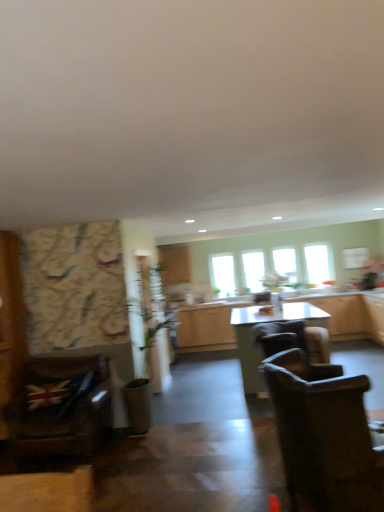
Measure the distance between velvet brown armchair at left, which appears as the 3th chair when viewed from the right, and camera.

A distance of 12.75 feet exists between velvet brown armchair at left, which appears as the 3th chair when viewed from the right, and camera.

How much space does matte wood cabinetry at center, the first cabinetry when ordered from top to bottom, occupy vertically?

It is 34.18 inches.

The height and width of the screenshot is (512, 384). What are the coordinates of `matte wood cabinetry at center, the 1th cabinetry viewed from the left` in the screenshot? It's located at (174, 264).

What is the approximate height of green leafy plant at center?

1.88 meters.

Measure the distance between point [313,245] and camera.

Point [313,245] is 23.21 feet from camera.

What do you see at coordinates (253, 270) in the screenshot?
I see `transparent glass window at center, which appears as the second window when viewed from the left` at bounding box center [253, 270].

What is the approximate width of dark brown fabric chair at lower right, acting as the third chair starting from the back?

dark brown fabric chair at lower right, acting as the third chair starting from the back, is 38.68 inches in width.

I want to click on velvet brown armchair at left, arranged as the second chair when viewed from the back, so click(60, 408).

Which of these two, green leafy plant at center or wooden cabinets at center, which ranks as the 1th cabinetry in bottom-to-top order, stands taller?

With more height is green leafy plant at center.

From the image's perspective, is green leafy plant at center located above wooden cabinets at center, placed as the second cabinetry when sorted from top to bottom?

Indeed, from the image's perspective, green leafy plant at center is shown above wooden cabinets at center, placed as the second cabinetry when sorted from top to bottom.

Is green leafy plant at center oriented towards wooden cabinets at center, the first cabinetry viewed from the right?

No, green leafy plant at center is not aimed at wooden cabinets at center, the first cabinetry viewed from the right.

Is green leafy plant at center to the left of wooden cabinets at center, the first cabinetry viewed from the right, from the viewer's perspective?

Indeed, green leafy plant at center is positioned on the left side of wooden cabinets at center, the first cabinetry viewed from the right.

At what (x,y) coordinates should I click in order to perform the action: click on the 4th window behind the wooden cabinets at center, which ranks as the 1th cabinetry in bottom-to-top order, counting from the anchor's position. Please return your answer as a coordinate pair (x, y). Looking at the image, I should click on (223, 274).

Between wooden cabinets at center, marked as the second cabinetry in a left-to-right arrangement, and transparent glass window at center, arranged as the first window when viewed from the left, which one has larger size?

Bigger between the two is wooden cabinets at center, marked as the second cabinetry in a left-to-right arrangement.

Is transparent glass window at center, arranged as the first window when viewed from the left, at the back of wooden cabinets at center, marked as the second cabinetry in a left-to-right arrangement?

No, wooden cabinets at center, marked as the second cabinetry in a left-to-right arrangement,'s orientation is not away from transparent glass window at center, arranged as the first window when viewed from the left.

Is transparent glass window at center, arranged as the first window when viewed from the left, bigger or smaller than dark brown fabric chair at lower right, which ranks as the first chair in front-to-back order?

In the image, transparent glass window at center, arranged as the first window when viewed from the left, appears to be smaller than dark brown fabric chair at lower right, which ranks as the first chair in front-to-back order.

Between transparent glass window at center, arranged as the first window when viewed from the left, and dark brown fabric chair at lower right, the second chair from the left, which one has less height?

With less height is transparent glass window at center, arranged as the first window when viewed from the left.

Could you tell me if transparent glass window at center, arranged as the first window when viewed from the left, is facing dark brown fabric chair at lower right, which appears as the second chair when viewed from the right?

Yes, transparent glass window at center, arranged as the first window when viewed from the left, is aimed at dark brown fabric chair at lower right, which appears as the second chair when viewed from the right.

Which object is closer to the camera taking this photo, transparent glass window at center, which is the 4th window in right-to-left order, or dark brown fabric chair at lower right, which appears as the second chair when viewed from the right?

dark brown fabric chair at lower right, which appears as the second chair when viewed from the right.

I want to click on the 1st chair in front of the clear glass window at center, acting as the second window starting from the right, starting your count from the anchor, so click(x=295, y=343).

What's the angular difference between clear glass window at center, which is counted as the 3th window, starting from the left, and brown leather chair at center, marked as the 3th chair in a front-to-back arrangement,'s facing directions?

They differ by 88.8 degrees in their facing directions.

Could you tell me if clear glass window at center, acting as the second window starting from the right, is facing brown leather chair at center, which is counted as the first chair, starting from the back?

Yes, clear glass window at center, acting as the second window starting from the right, faces towards brown leather chair at center, which is counted as the first chair, starting from the back.

Considering the points (279, 272) and (286, 344), which point is in front, point (279, 272) or point (286, 344)?

Positioned in front is point (286, 344).

Is transparent glass window at center, which appears as the 3th window when viewed from the right, next to brown leather chair at center, the 1th chair when ordered from right to left?

No, transparent glass window at center, which appears as the 3th window when viewed from the right, is not in contact with brown leather chair at center, the 1th chair when ordered from right to left.

Does transparent glass window at center, which appears as the 3th window when viewed from the right, lie behind brown leather chair at center, the 1th chair when ordered from right to left?

Yes.

From a real-world perspective, count 2nd chairs downward from the transparent glass window at center, which appears as the second window when viewed from the left, and point to it. Please provide its 2D coordinates.

[(295, 343)]

Is transparent glass window at center, which appears as the second window when viewed from the left, facing away from brown leather chair at center, marked as the 3th chair in a front-to-back arrangement?

No, transparent glass window at center, which appears as the second window when viewed from the left, is not facing the opposite direction of brown leather chair at center, marked as the 3th chair in a front-to-back arrangement.

In the scene shown: Can you see clear glass window at center, which is counted as the 3th window, starting from the left, touching wooden cabinets at center, marked as the second cabinetry in a left-to-right arrangement?

clear glass window at center, which is counted as the 3th window, starting from the left, and wooden cabinets at center, marked as the second cabinetry in a left-to-right arrangement, are not in contact.

Which point is more forward, (294,281) or (321,298)?

Positioned in front is point (321,298).

This screenshot has width=384, height=512. In order to click on cabinetry lying below the clear glass window at center, which is counted as the 3th window, starting from the left (from the image's perspective) in this screenshot , I will do `click(351, 314)`.

Considering the relative sizes of clear glass window at center, which is counted as the 3th window, starting from the left, and wooden cabinets at center, placed as the second cabinetry when sorted from top to bottom, in the image provided, is clear glass window at center, which is counted as the 3th window, starting from the left, bigger than wooden cabinets at center, placed as the second cabinetry when sorted from top to bottom,?

No.

How different are the orientations of transparent glass window at center, which appears as the 3th window when viewed from the right, and matte wood cabinetry at center, the 1th cabinetry viewed from the left, in degrees?

They differ by 88.2 degrees in their facing directions.

Is transparent glass window at center, which appears as the 3th window when viewed from the right, positioned beyond the bounds of matte wood cabinetry at center, the first cabinetry when ordered from top to bottom?

Yes, transparent glass window at center, which appears as the 3th window when viewed from the right, is not within matte wood cabinetry at center, the first cabinetry when ordered from top to bottom.

Which of these two, transparent glass window at center, which appears as the second window when viewed from the left, or matte wood cabinetry at center, the first cabinetry when ordered from top to bottom, is wider?

matte wood cabinetry at center, the first cabinetry when ordered from top to bottom.

Is transparent glass window at center, which appears as the 3th window when viewed from the right, far away from matte wood cabinetry at center, which is counted as the second cabinetry, starting from the bottom?

transparent glass window at center, which appears as the 3th window when viewed from the right, is far away from matte wood cabinetry at center, which is counted as the second cabinetry, starting from the bottom.

In order to click on houseplant that is above the wooden cabinets at center, placed as the second cabinetry when sorted from top to bottom (from the image's perspective) in this screenshot , I will do `click(145, 346)`.

Where is `cabinetry located on the right of transparent glass window at center, which is the 4th window in right-to-left order`? This screenshot has width=384, height=512. cabinetry located on the right of transparent glass window at center, which is the 4th window in right-to-left order is located at coordinates (351, 314).

When comparing their distances from transparent glass window at center, which appears as the 3th window when viewed from the right, does transparent glass window at upper right, the 1th window in the right-to-left sequence, or clear glass window at center, acting as the second window starting from the right, seem closer?

Among the two, clear glass window at center, acting as the second window starting from the right, is located nearer to transparent glass window at center, which appears as the 3th window when viewed from the right.

Considering their positions, is brown leather chair at center, the third chair in the left-to-right sequence, positioned closer to matte wood cabinetry at center, the 1th cabinetry viewed from the left, than clear glass window at center, which is counted as the 3th window, starting from the left?

The object closer to matte wood cabinetry at center, the 1th cabinetry viewed from the left, is clear glass window at center, which is counted as the 3th window, starting from the left.

From the image, which object appears to be nearer to brown leather chair at center, the 1th chair when ordered from right to left, dark brown fabric chair at lower right, the second chair from the left, or green leafy plant at center?

dark brown fabric chair at lower right, the second chair from the left, is closer to brown leather chair at center, the 1th chair when ordered from right to left.

Based on their spatial positions, is clear glass window at center, which is counted as the 3th window, starting from the left, or transparent glass window at center, which is the 4th window in right-to-left order, closer to transparent glass window at upper right, the 1th window in the right-to-left sequence?

clear glass window at center, which is counted as the 3th window, starting from the left, is closer to transparent glass window at upper right, the 1th window in the right-to-left sequence.

Which object lies further to the anchor point matte wood cabinetry at center, the first cabinetry when ordered from top to bottom, transparent glass window at center, which appears as the second window when viewed from the left, or transparent glass window at center, which is the 4th window in right-to-left order?

transparent glass window at center, which appears as the second window when viewed from the left, is positioned further to the anchor matte wood cabinetry at center, the first cabinetry when ordered from top to bottom.

Which object lies further to the anchor point transparent glass window at center, which appears as the second window when viewed from the left, transparent glass window at center, which is the 4th window in right-to-left order, or velvet brown armchair at left, the first chair positioned from the left?

velvet brown armchair at left, the first chair positioned from the left, lies further to transparent glass window at center, which appears as the second window when viewed from the left, than the other object.

Considering their positions, is transparent glass window at upper right, arranged as the fourth window when viewed from the left, positioned closer to velvet brown armchair at left, which is counted as the 2th chair, starting from the front, than matte wood cabinetry at center, arranged as the 2th cabinetry when viewed from the right?

matte wood cabinetry at center, arranged as the 2th cabinetry when viewed from the right, lies closer to velvet brown armchair at left, which is counted as the 2th chair, starting from the front, than the other object.

Which object lies further to the anchor point velvet brown armchair at left, which is counted as the 2th chair, starting from the front, transparent glass window at center, arranged as the first window when viewed from the left, or wooden cabinets at center, placed as the second cabinetry when sorted from top to bottom?

transparent glass window at center, arranged as the first window when viewed from the left, is further to velvet brown armchair at left, which is counted as the 2th chair, starting from the front.

Identify the location of window between brown leather chair at center, the 1th chair when ordered from right to left, and clear glass window at center, which is counted as the 3th window, starting from the left, from front to back. (319, 263).

At what (x,y) coordinates should I click in order to perform the action: click on window between dark brown fabric chair at lower right, which appears as the second chair when viewed from the right, and clear glass window at center, acting as the second window starting from the right, along the z-axis. Please return your answer as a coordinate pair (x, y). The height and width of the screenshot is (512, 384). Looking at the image, I should click on (319, 263).

Locate an element on the screen. This screenshot has height=512, width=384. window located between matte wood cabinetry at center, the 1th cabinetry viewed from the left, and transparent glass window at center, which appears as the second window when viewed from the left, in the left-right direction is located at coordinates (223, 274).

The image size is (384, 512). I want to click on chair between green leafy plant at center and clear glass window at center, acting as the second window starting from the right, from front to back, so click(x=295, y=343).